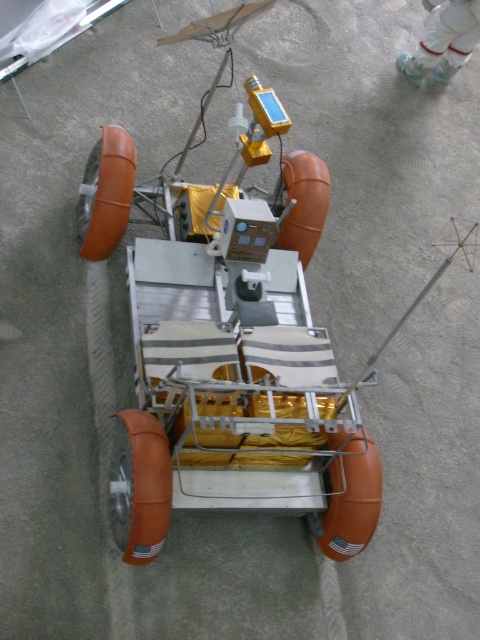
Question: Is the position of metallic silver rover at center more distant than that of white fabric suit at upper center?

Choices:
 (A) yes
 (B) no

Answer: (B)

Question: In this image, where is metallic silver rover at center located relative to white fabric suit at upper center?

Choices:
 (A) above
 (B) below

Answer: (B)

Question: Which point is closer to the camera?

Choices:
 (A) white fabric suit at upper center
 (B) metallic silver rover at center

Answer: (B)

Question: Which point is farther to the camera?

Choices:
 (A) (444, 10)
 (B) (310, 456)

Answer: (A)

Question: Is metallic silver rover at center behind white fabric suit at upper center?

Choices:
 (A) no
 (B) yes

Answer: (A)